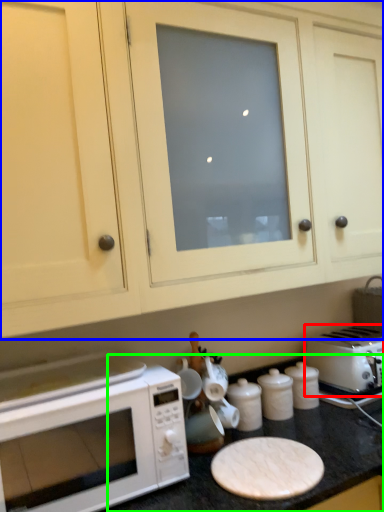
Question: Which object is positioned closest to toaster (highlighted by a red box)? Select from cabinetry (highlighted by a blue box) and counter top (highlighted by a green box).

Choices:
 (A) cabinetry
 (B) counter top

Answer: (B)